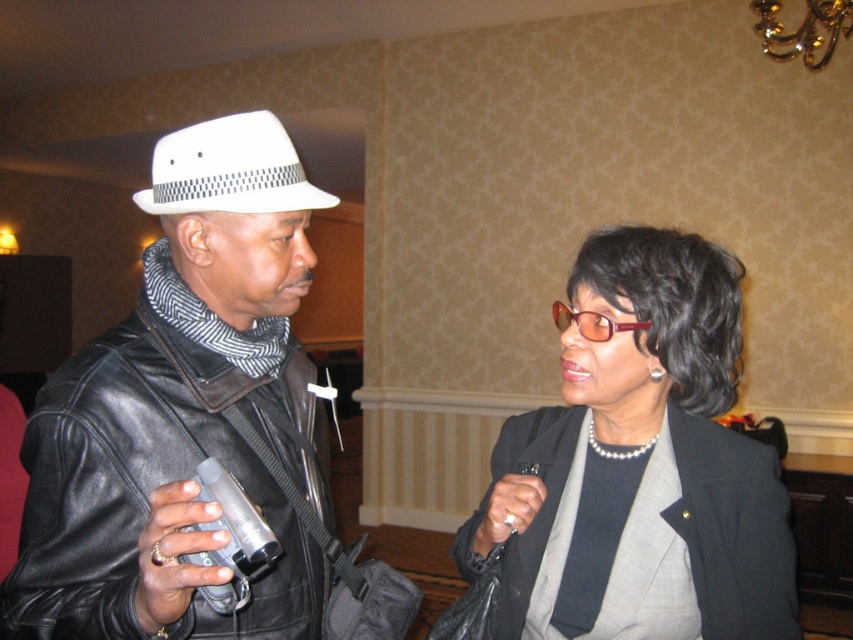
Between pearl necklace at center and white felt fedora at left, which one has less height?

With less height is white felt fedora at left.

Is pearl necklace at center positioned before white felt fedora at left?

That is False.

The height and width of the screenshot is (640, 853). Describe the element at coordinates (640, 465) in the screenshot. I see `pearl necklace at center` at that location.

Locate an element on the screen. The image size is (853, 640). pearl necklace at center is located at coordinates (640, 465).

Is matte black leather jacket at left further to camera compared to white felt fedora at left?

No, matte black leather jacket at left is in front of white felt fedora at left.

Describe the element at coordinates (181, 410) in the screenshot. I see `matte black leather jacket at left` at that location.

This screenshot has height=640, width=853. Find the location of `matte black leather jacket at left`. matte black leather jacket at left is located at coordinates (181, 410).

Describe the element at coordinates (181, 410) in the screenshot. I see `matte black leather jacket at left` at that location.

Which is behind, point (218, 166) or point (578, 356)?

Positioned behind is point (578, 356).

Where is `matte black leather jacket at left`? matte black leather jacket at left is located at coordinates (181, 410).